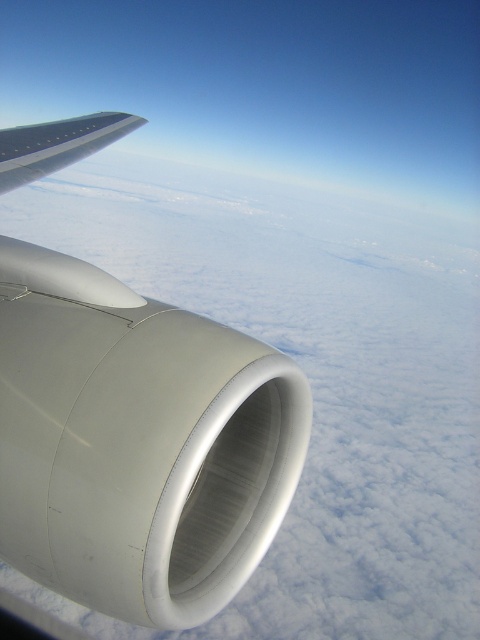
Question: Does matte white jet engine at center have a larger size compared to silver metallic wing at upper left?

Choices:
 (A) no
 (B) yes

Answer: (A)

Question: Which point is closer to the camera?

Choices:
 (A) matte white jet engine at center
 (B) silver metallic wing at upper left

Answer: (A)

Question: Which object is closer to the camera taking this photo?

Choices:
 (A) matte white jet engine at center
 (B) silver metallic wing at upper left

Answer: (A)

Question: Does matte white jet engine at center appear on the left side of silver metallic wing at upper left?

Choices:
 (A) no
 (B) yes

Answer: (A)

Question: Can you confirm if matte white jet engine at center is positioned to the left of silver metallic wing at upper left?

Choices:
 (A) yes
 (B) no

Answer: (B)